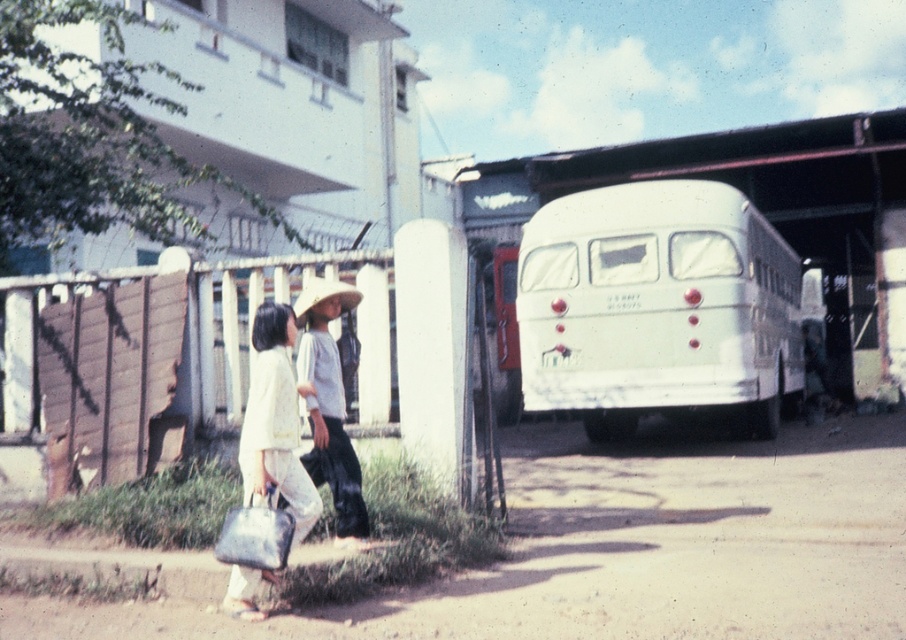
Question: Considering the real-world distances, which object is closest to the white matte bus at center?

Choices:
 (A) strawmaterial/texturehat at upper center
 (B) white matte dress at lower left
 (C) white matte hat at center
 (D) metallic silver bag at lower left

Answer: (C)

Question: Is white matte dress at lower left below white matte hat at center?

Choices:
 (A) yes
 (B) no

Answer: (A)

Question: Which point appears closest to the camera in this image?

Choices:
 (A) (248, 538)
 (B) (320, 316)
 (C) (355, 307)
 (D) (668, 330)

Answer: (A)

Question: Is white matte dress at lower left to the right of metallic silver bag at lower left from the viewer's perspective?

Choices:
 (A) yes
 (B) no

Answer: (A)

Question: Which point is closer to the camera taking this photo?

Choices:
 (A) click(x=341, y=499)
 (B) click(x=723, y=342)
 (C) click(x=352, y=296)

Answer: (A)

Question: In this image, where is white matte bus at center located relative to metallic silver bag at lower left?

Choices:
 (A) above
 (B) below

Answer: (A)